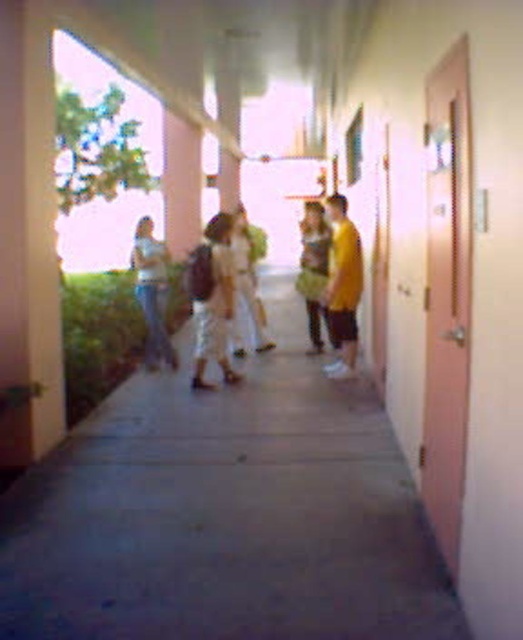
You are a delivery person who needs to place a small package on the floor. The package must be placed in a spot that is lower than both the matte brown backpack at center and the denim jeans at left. Is there a suitable location in the hallway to do this?

The matte brown backpack at center is taller than the denim jeans at left. Since the package needs to be placed lower than both, you can place it on the floor near the denim jeans at left, as it is already lower than the backpack.

You are standing in the hallway and see the matte brown backpack at center and the denim jeans at left. Which object is nearer to you?

The matte brown backpack at center is closer to the viewer than the denim jeans at left.